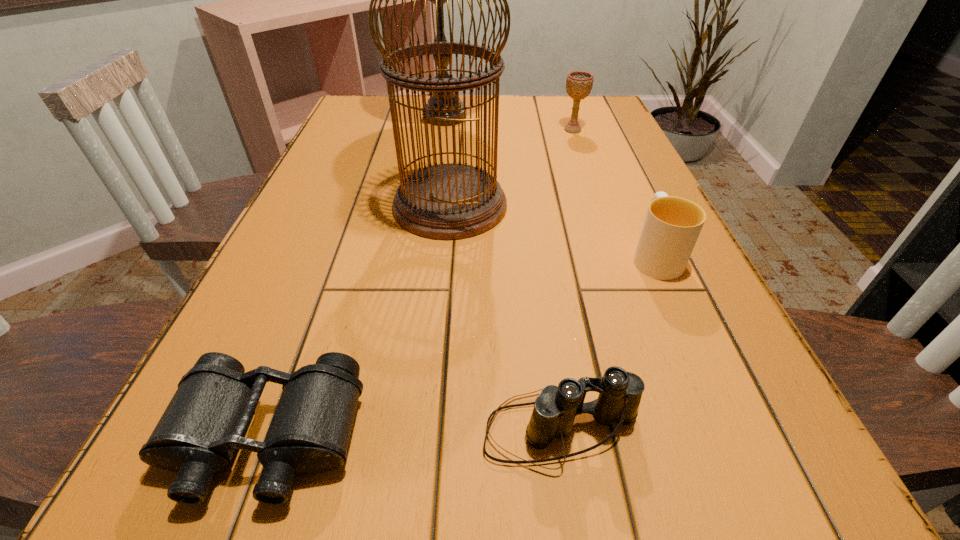
The width and height of the screenshot is (960, 540). I want to click on lamp, so click(440, 26).

Locate an element on the screen. The width and height of the screenshot is (960, 540). birdcage is located at coordinates (451, 201).

The height and width of the screenshot is (540, 960). In order to click on the third tallest object in this screenshot , I will do `click(578, 83)`.

At what (x,y) coordinates should I click in order to perform the action: click on the fourth tallest object. Please return your answer as a coordinate pair (x, y). The height and width of the screenshot is (540, 960). Looking at the image, I should click on (672, 225).

The height and width of the screenshot is (540, 960). I want to click on the right binoculars, so click(x=620, y=392).

I want to click on the taller binoculars, so click(x=620, y=392).

I want to click on the shorter binoculars, so click(206, 420).

Where is `the left binoculars`? Image resolution: width=960 pixels, height=540 pixels. the left binoculars is located at coordinates (206, 420).

This screenshot has height=540, width=960. What are the coordinates of `free space located 0.090m on the front of the lamp` in the screenshot? It's located at (440, 159).

You are a GUI agent. You are given a task and a screenshot of the screen. Output one action in this format:
    pyautogui.click(x=<x>, y=<y>)
    Task: Click on the vacant region located 0.230m on the front-facing side of the birdcage
    This screenshot has height=540, width=960.
    Given the screenshot: What is the action you would take?
    click(614, 205)